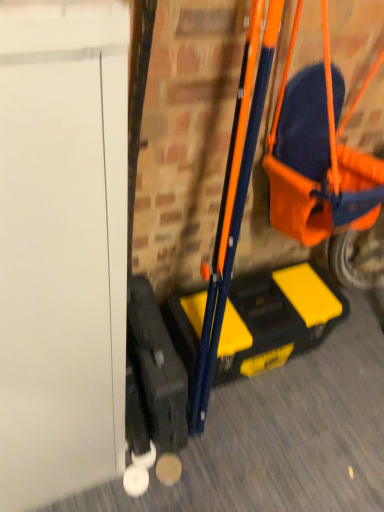
Question: Should I look upward or downward to see orange fabric baby carriage at right?

Choices:
 (A) up
 (B) down

Answer: (A)